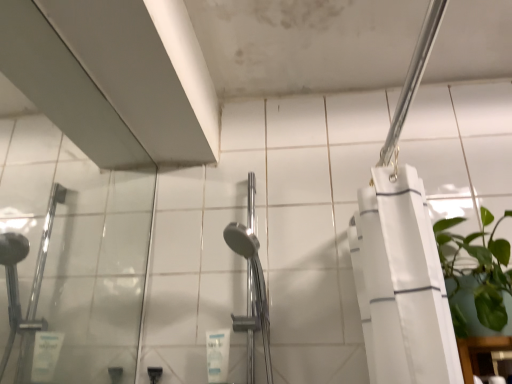
The width and height of the screenshot is (512, 384). What are the coordinates of `transparent plastic bottle at lower center` in the screenshot? It's located at (217, 355).

The image size is (512, 384). What do you see at coordinates (217, 355) in the screenshot?
I see `transparent plastic bottle at lower center` at bounding box center [217, 355].

Identify the location of transparent plastic bottle at lower center. (217, 355).